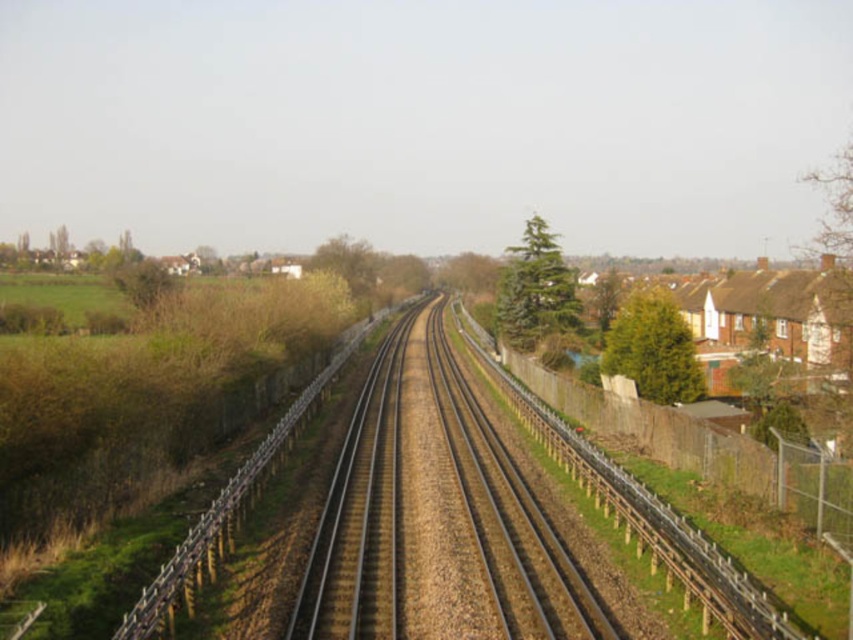
How far apart are metallic train tracks at center and green leafy tree at center?

metallic train tracks at center is 54.41 meters from green leafy tree at center.

Is metallic train tracks at center above green leafy tree at center?

No, metallic train tracks at center is not above green leafy tree at center.

Measure the distance between metallic train tracks at center and camera.

metallic train tracks at center is 38.19 feet from camera.

Where is `metallic train tracks at center`? metallic train tracks at center is located at coordinates (436, 509).

Can you confirm if metallic train tracks at center is smaller than green textured tree at right?

Yes, metallic train tracks at center is smaller than green textured tree at right.

Measure the distance between metallic train tracks at center and camera.

metallic train tracks at center is 38.19 feet away from camera.

Is point (582, 636) positioned after point (688, 372)?

That is False.

The height and width of the screenshot is (640, 853). Identify the location of metallic train tracks at center. (436, 509).

From the picture: Is green textured tree at right behind green leafy tree at center?

No, green textured tree at right is in front of green leafy tree at center.

Is point (619, 307) farther from viewer compared to point (374, 262)?

No.

Is point (700, 397) farther from viewer compared to point (367, 269)?

No, (700, 397) is in front of (367, 269).

This screenshot has width=853, height=640. I want to click on green textured tree at right, so click(653, 348).